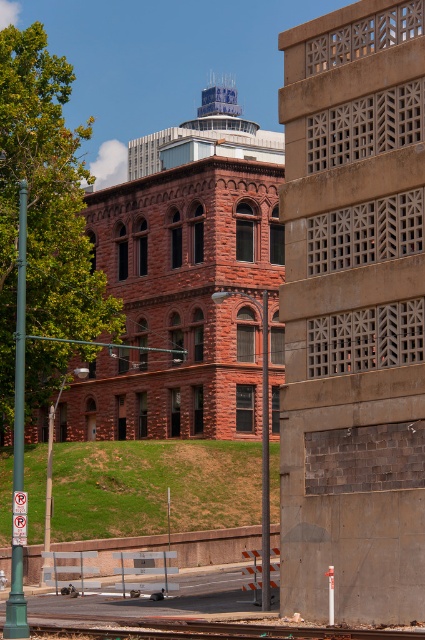
Question: Among these points, which one is nearest to the camera?

Choices:
 (A) (325, 470)
 (B) (411, 634)

Answer: (B)

Question: Among these objects, which one is nearest to the camera?

Choices:
 (A) brown textured wall at center right
 (B) smooth concrete train track at lower center

Answer: (B)

Question: Does brown textured wall at center right appear on the left side of smooth concrete train track at lower center?

Choices:
 (A) no
 (B) yes

Answer: (A)

Question: Is brown textured wall at center right to the right of smooth concrete train track at lower center from the viewer's perspective?

Choices:
 (A) no
 (B) yes

Answer: (B)

Question: Can you confirm if brown textured wall at center right is thinner than smooth concrete train track at lower center?

Choices:
 (A) no
 (B) yes

Answer: (B)